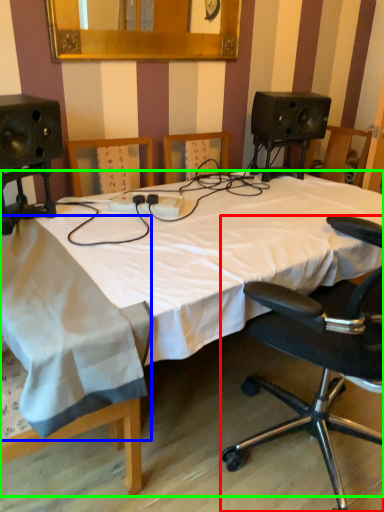
Question: Based on their relative distances, which object is nearer to chair (highlighted by a red box)? Choose from sheet (highlighted by a blue box) and bed (highlighted by a green box).

Choices:
 (A) sheet
 (B) bed

Answer: (B)